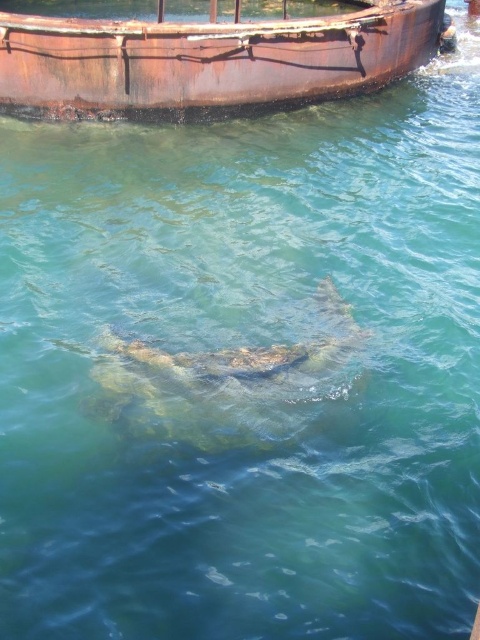
Question: Does rusty metal boat at upper center have a greater width compared to translucent greenish-brown fish at center?

Choices:
 (A) yes
 (B) no

Answer: (A)

Question: Is rusty metal boat at upper center bigger than translucent greenish-brown fish at center?

Choices:
 (A) no
 (B) yes

Answer: (B)

Question: Is rusty metal boat at upper center to the left of translucent greenish-brown fish at center from the viewer's perspective?

Choices:
 (A) yes
 (B) no

Answer: (A)

Question: Which object is farther from the camera taking this photo?

Choices:
 (A) rusty metal boat at upper center
 (B) translucent greenish-brown fish at center

Answer: (A)

Question: Which object is farther from the camera taking this photo?

Choices:
 (A) translucent greenish-brown fish at center
 (B) rusty metal boat at upper center

Answer: (B)